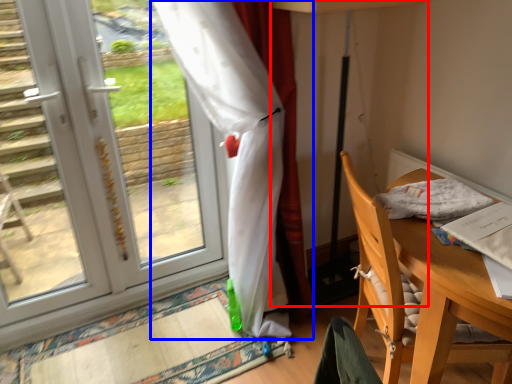
Question: Which of the following is the closest to the observer, table lamp (highlighted by a red box) or curtain (highlighted by a blue box)?

Choices:
 (A) table lamp
 (B) curtain

Answer: (B)